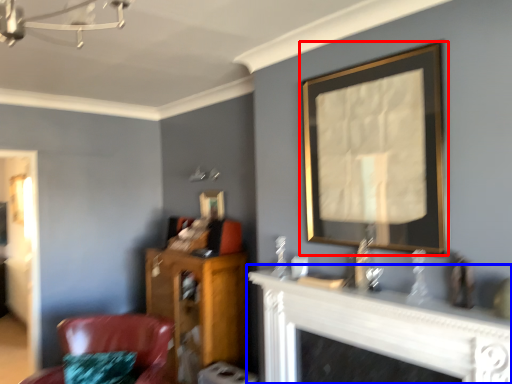
Question: Which object appears farthest to the camera in this image, picture frame (highlighted by a red box) or fireplace (highlighted by a blue box)?

Choices:
 (A) picture frame
 (B) fireplace

Answer: (A)